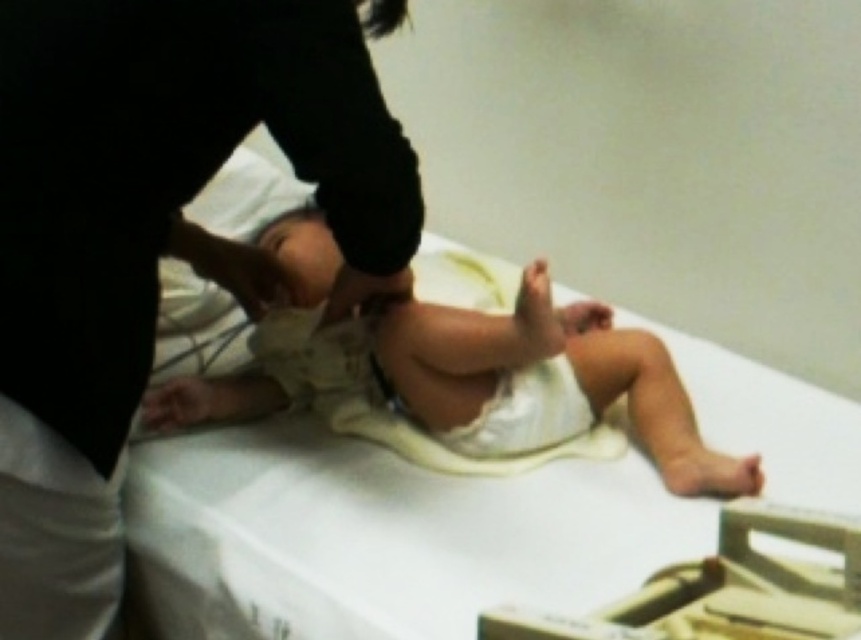
You are a medical professional observing the baby and the person during an examination. You need to locate two specific points for a procedure. The first point is at coordinates point (196, 36) and the second is at point (440, 394). Which point is closer to the baby?

Point (196, 36) is in front of point (440, 394), so it is closer to the baby.

You are a nurse entering the room and need to locate the light beige fabric baby at center. Based on the scene description, where should you look relative to the black fabric at upper left?

The light beige fabric baby at center is much shorter than the black fabric at upper left, so you should look downward from the black fabric at upper left to find the light beige fabric baby at center.

You are a medical professional observing the baby on the examination table. There is a black fabric at upper left located at point (153, 236). What is the position of the black fabric at upper left relative to the baby?

The black fabric at upper left is located at point (153, 236), which is to the upper left of the baby on the examination table.